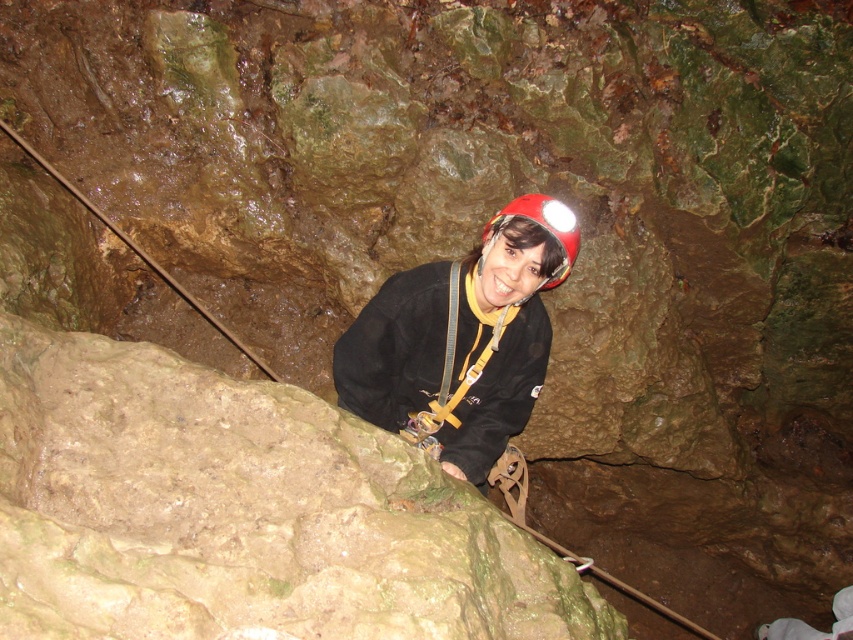
Is matte black jacket at center to the right of red matte helmet at center from the viewer's perspective?

Incorrect, matte black jacket at center is not on the right side of red matte helmet at center.

Between matte black jacket at center and red matte helmet at center, which one has less height?

red matte helmet at center is shorter.

The width and height of the screenshot is (853, 640). Find the location of `matte black jacket at center`. matte black jacket at center is located at coordinates (x=462, y=337).

This screenshot has width=853, height=640. I want to click on matte black jacket at center, so click(462, 337).